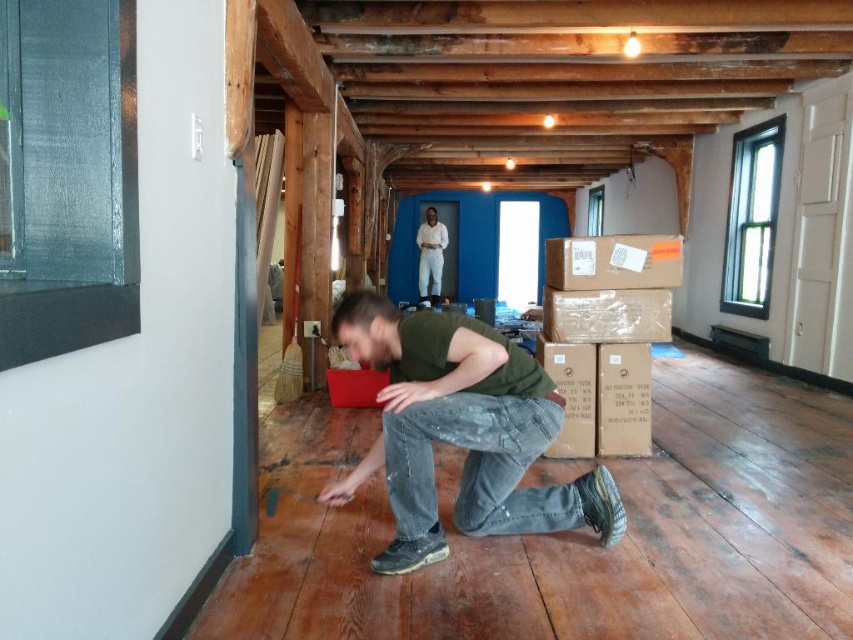
You are a photographer standing in the room and see the matte green shirt at center. You want to take a photo of it with your camera. Can you reach the camera without moving from your current position?

The matte green shirt at center and camera are 6.01 feet apart. Since the distance is more than arm length, you cannot reach the camera to take a photo of the matte green shirt at center without moving.

You are standing in the room and see the matte green shirt at center and the matte brown cardboard box at center. Which object is closer to the floor?

The matte green shirt at center is below the matte brown cardboard box at center, so it is closer to the floor.

You are standing in the room and see the matte green shirt at center and the white cotton shirt at center. Which shirt is closer to you?

The matte green shirt at center is closer to you because it is in front of the white cotton shirt at center.